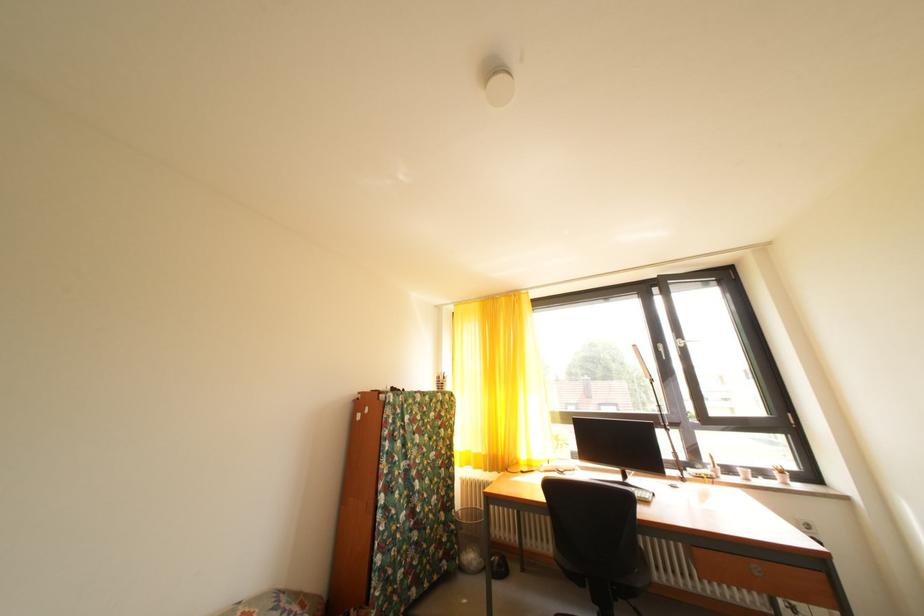
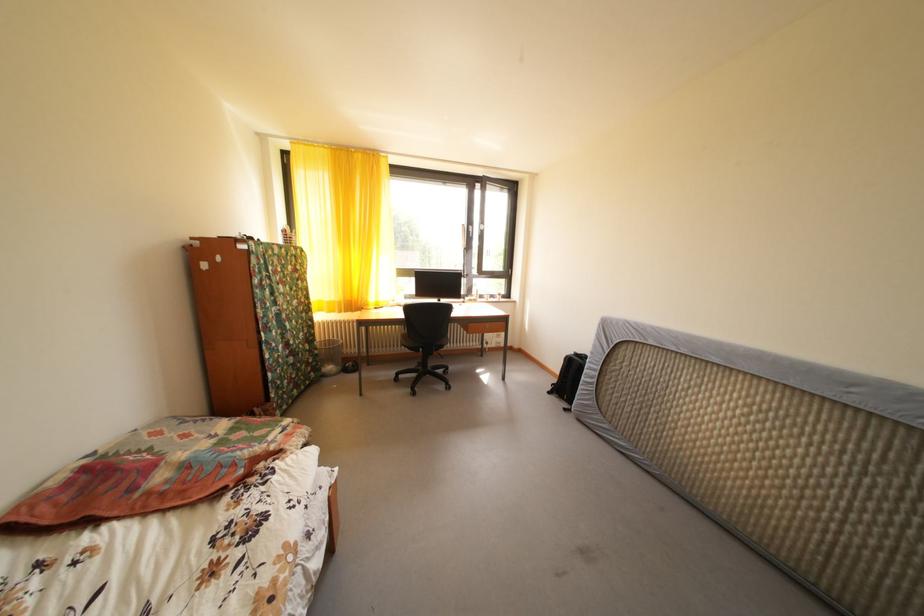
In the second image, find the point that corresponds to point 454,530 in the first image.

(320, 357)